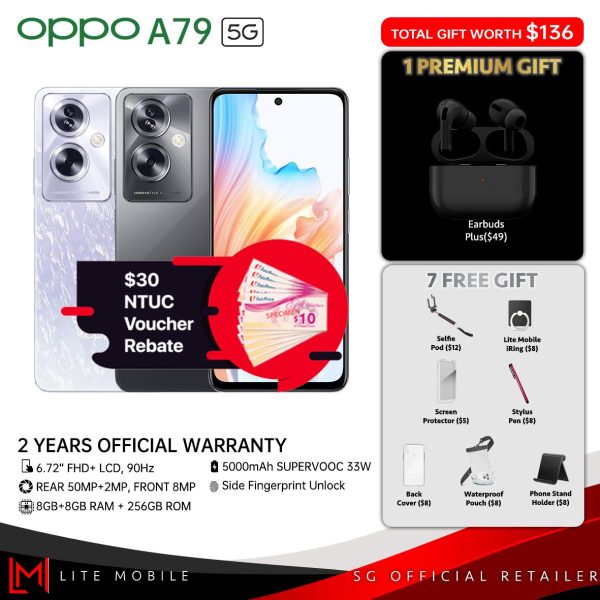
Find the location of a particular element. The height and width of the screenshot is (600, 600). image of a pair of wireless black headphones is located at coordinates (464, 145).